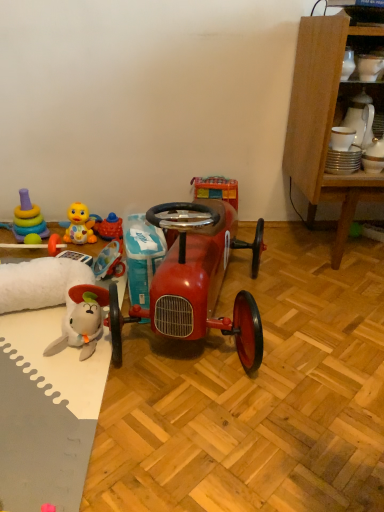
Where is `vacant area that is in front of wooden cabinet at right`? The image size is (384, 512). vacant area that is in front of wooden cabinet at right is located at coordinates (334, 308).